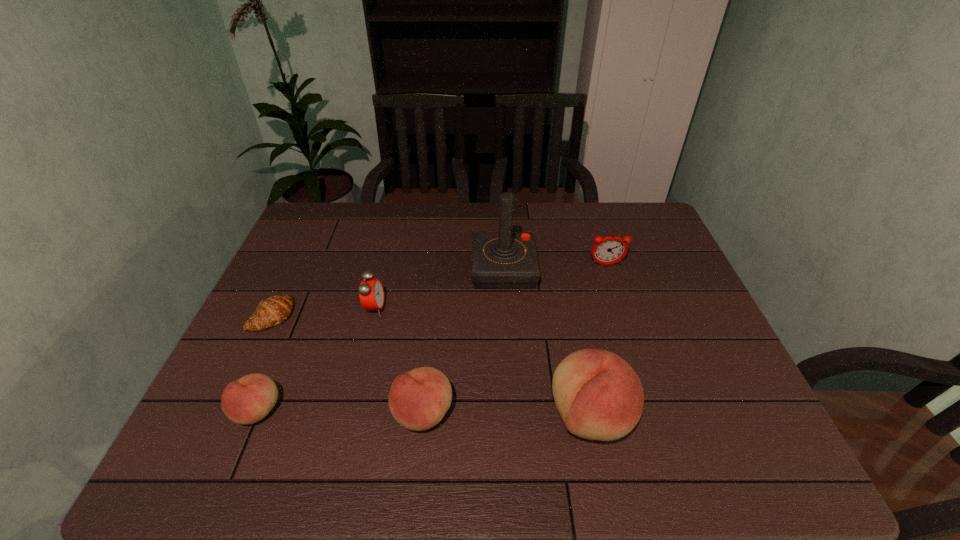
The height and width of the screenshot is (540, 960). I want to click on the shortest object, so click(276, 309).

Identify the location of free space located on the back of the second shortest object. (311, 282).

Image resolution: width=960 pixels, height=540 pixels. Identify the location of free space located on the right of the second peach from right to left. (615, 413).

At what (x,y) coordinates should I click in order to perform the action: click on free spot located on the left of the sixth shortest object. Please return your answer as a coordinate pair (x, y). The height and width of the screenshot is (540, 960). Looking at the image, I should click on (486, 416).

Where is `vacant region located 0.050m on the front-facing side of the farther alarm clock`? This screenshot has height=540, width=960. vacant region located 0.050m on the front-facing side of the farther alarm clock is located at coordinates (611, 279).

I want to click on free space located 0.330m on the rectangular base of the joystick, so click(363, 269).

At what (x,y) coordinates should I click in order to perform the action: click on vacant space situated 0.140m on the rectangular base of the joystick. Please return your answer as a coordinate pair (x, y). The width and height of the screenshot is (960, 540). Looking at the image, I should click on (426, 269).

You are a GUI agent. You are given a task and a screenshot of the screen. Output one action in this format:
    pyautogui.click(x=<x>, y=<y>)
    Task: Click on the free location located 0.150m on the rectangular base of the joystick
    
    Given the screenshot: What is the action you would take?
    pyautogui.click(x=422, y=269)

At what (x,y) coordinates should I click in order to perform the action: click on vacant space located 0.280m on the front-facing side of the nearer alarm clock. Please return your answer as a coordinate pair (x, y). Image resolution: width=960 pixels, height=540 pixels. Looking at the image, I should click on (487, 309).

I want to click on free space located 0.380m on the back of the shortest object, so click(x=318, y=221).